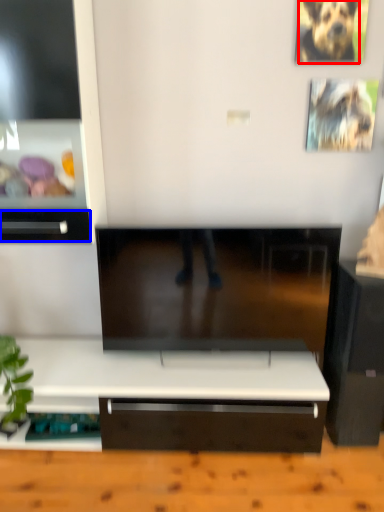
Question: Among these objects, which one is farthest to the camera, animal (highlighted by a red box) or drawer (highlighted by a blue box)?

Choices:
 (A) animal
 (B) drawer

Answer: (A)